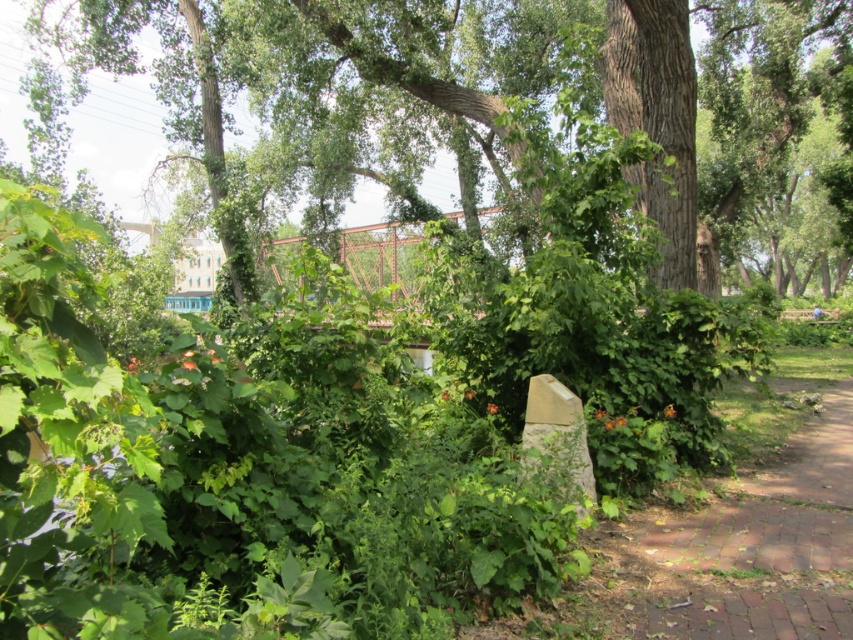
Question: From the image, what is the correct spatial relationship of brick paved path at lower right in relation to green leafy tree at center?

Choices:
 (A) right
 (B) left

Answer: (B)

Question: Can you confirm if brick paved path at lower right is positioned to the right of green leafy tree at center?

Choices:
 (A) yes
 (B) no

Answer: (B)

Question: Which point is closer to the camera taking this photo?

Choices:
 (A) (746, 568)
 (B) (776, 209)

Answer: (A)

Question: Does brick paved path at lower right have a lesser width compared to green leafy tree at center?

Choices:
 (A) yes
 (B) no

Answer: (A)

Question: Which point appears farthest from the camera in this image?

Choices:
 (A) (805, 600)
 (B) (786, 241)

Answer: (B)